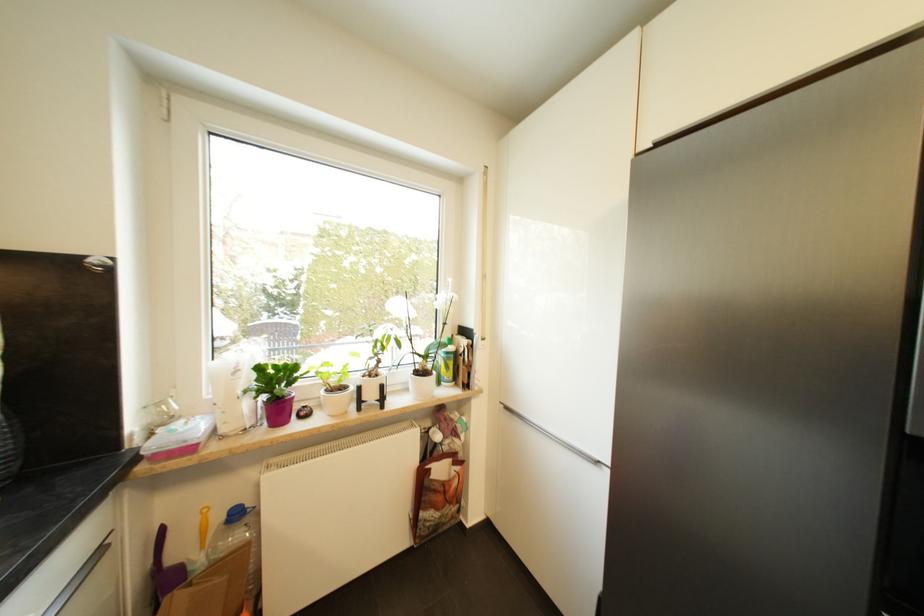
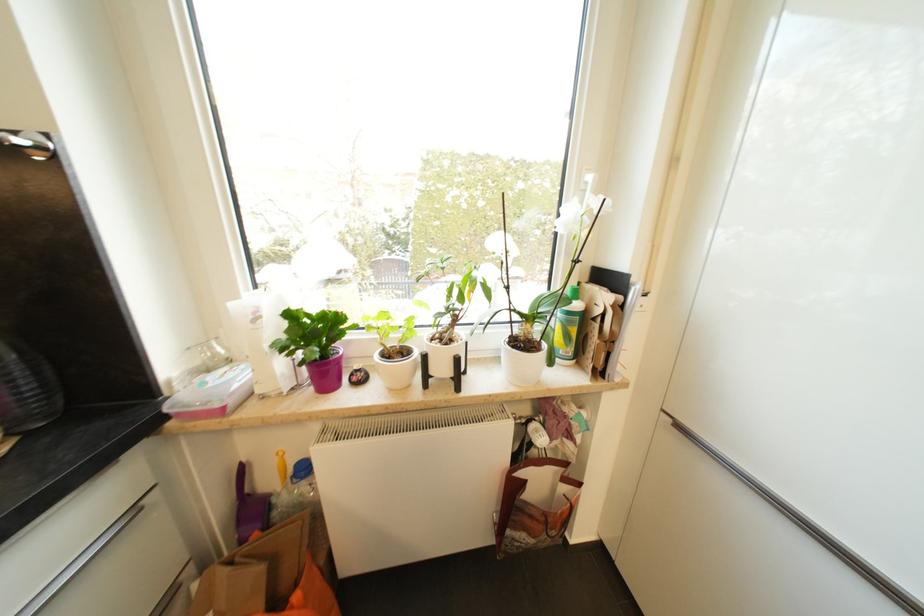
Question: What movement of the cameraman would produce the second image?

Choices:
 (A) Left
 (B) Right
 (C) Forward
 (D) Backward

Answer: (C)